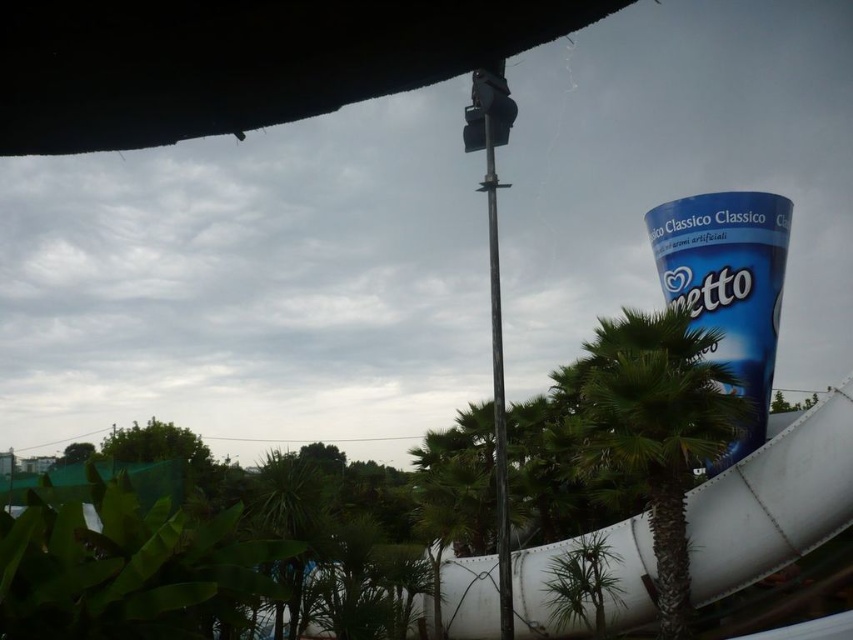
In the scene shown: You are designing a new layout for an outdoor space and need to place both the white matte slide at right and the green leafy palm tree at center. Based on their sizes, which object should you prioritize placing first to ensure there is enough space?

The green leafy palm tree at center requires more space since it occupies more area than the white matte slide at right. Therefore, you should prioritize placing the green leafy palm tree at center first to ensure adequate space allocation.

You are at a park and want to find the slide. You see a black matte canopy at upper center and a white matte slide at right. Which object is positioned to the left of the slide?

The black matte canopy at upper center is positioned to the left of the white matte slide at right.